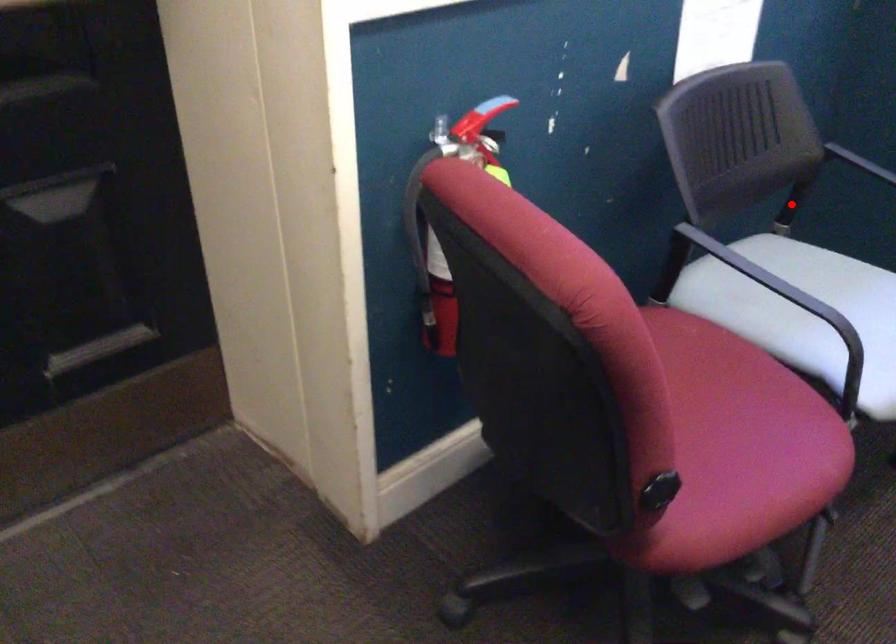
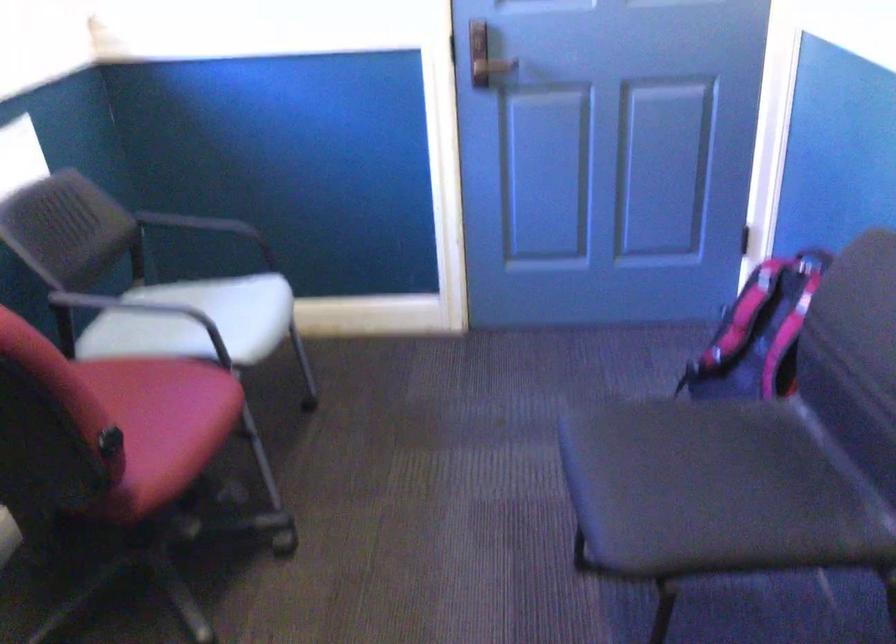
Question: I am providing you with two images of the same scene from different viewpoints. Image1 has a red point marked. In image2, the corresponding 3D location appears at what relative position? Reply with the corresponding letter.

Choices:
 (A) Closer
 (B) Farther

Answer: (B)